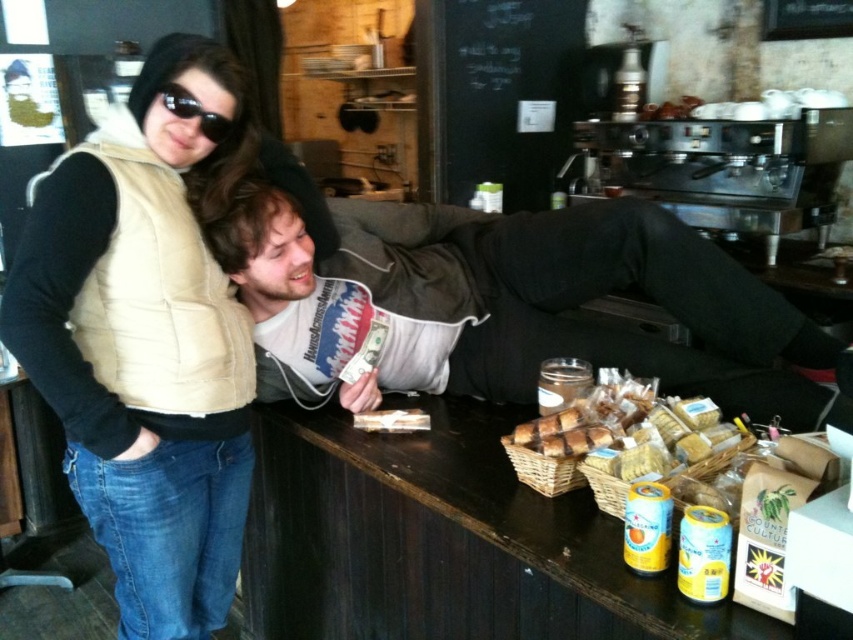
Question: Observing the image, what is the correct spatial positioning of beige quilted vest at upper left in reference to black matte sunglasses at upper left?

Choices:
 (A) left
 (B) right

Answer: (A)

Question: Which of these objects is positioned closest to the dark brown leather jacket at center?

Choices:
 (A) black chalkboard at upper center
 (B) golden brown wicker basket at center
 (C) black matte sunglasses at upper left

Answer: (B)

Question: Estimate the real-world distances between objects in this image. Which object is closer to the beige quilted vest at upper left?

Choices:
 (A) golden brown wicker basket at center
 (B) black chalkboard at upper center

Answer: (A)

Question: Which object is positioned closest to the black chalkboard at upper center?

Choices:
 (A) beige quilted vest at upper left
 (B) black matte sunglasses at upper left

Answer: (A)

Question: Does golden brown wicker basket at center lie behind black matte sunglasses at upper left?

Choices:
 (A) no
 (B) yes

Answer: (A)

Question: Does beige quilted vest at upper left have a lesser width compared to dark brown leather jacket at center?

Choices:
 (A) no
 (B) yes

Answer: (B)